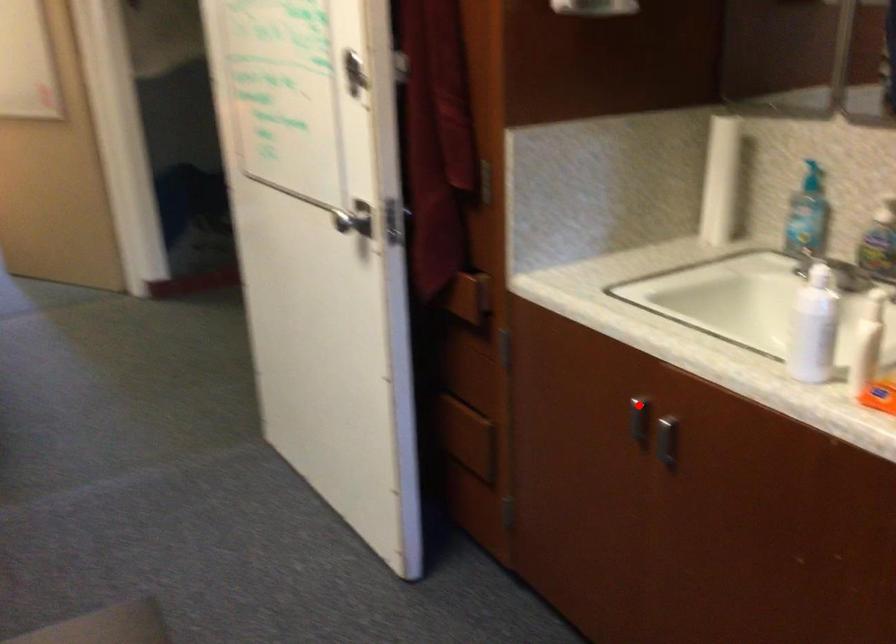
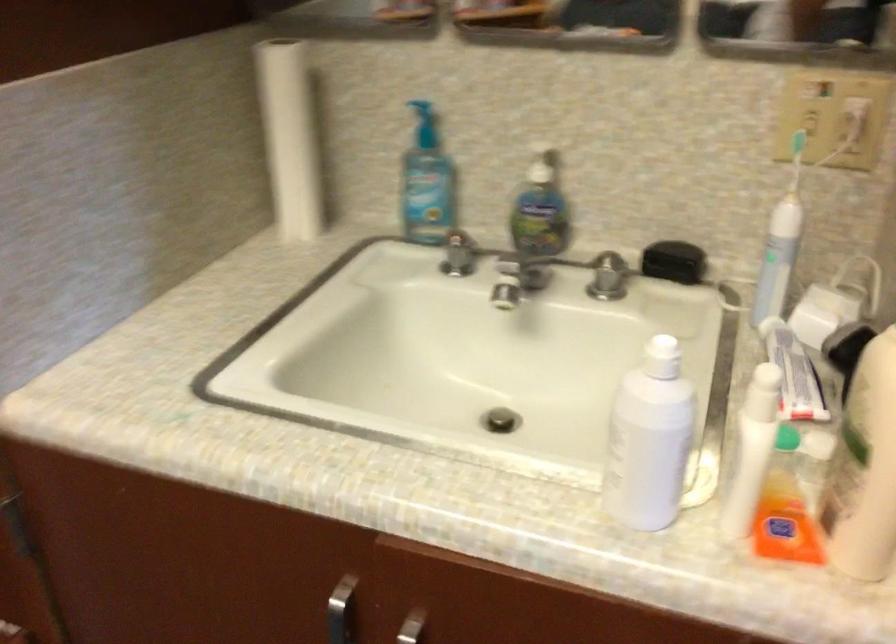
In the second image, find the point that corresponds to the highlighted location in the first image.

(340, 611)